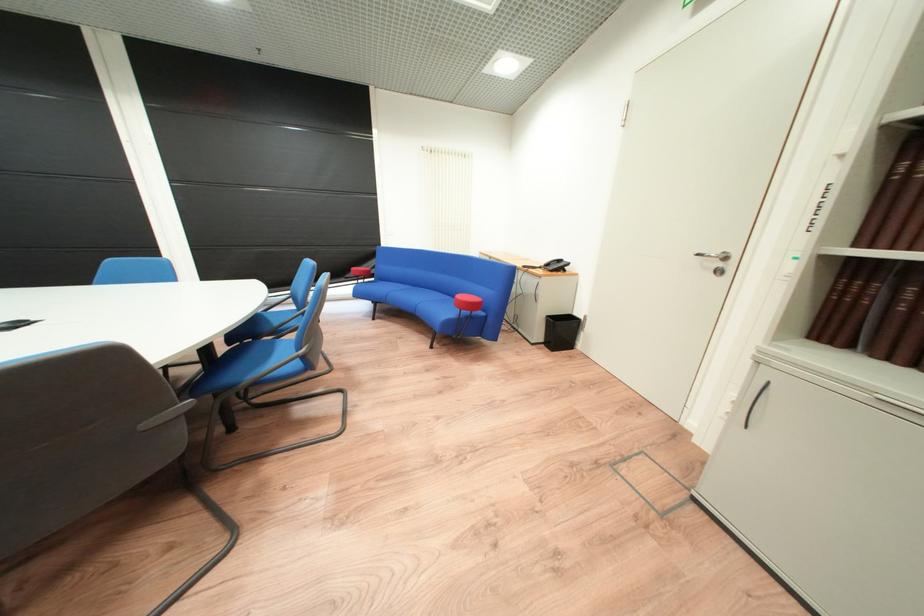
What do you see at coordinates (467, 302) in the screenshot? I see `the red sofa armrest` at bounding box center [467, 302].